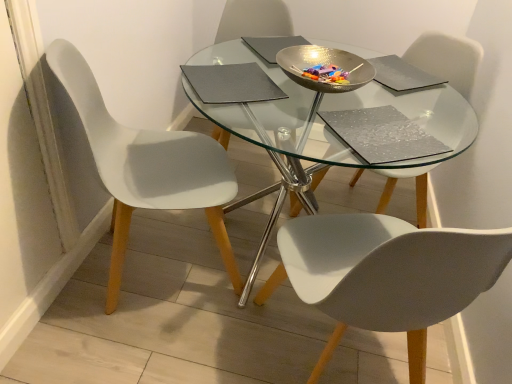
Question: From their relative heights in the image, would you say hammered metal bowl at center is taller or shorter than matte gray pad at upper center, which is the first pad from top to bottom?

Choices:
 (A) short
 (B) tall

Answer: (B)

Question: Considering the relative positions of hammered metal bowl at center and matte gray pad at upper center, which is the first pad from top to bottom, in the image provided, is hammered metal bowl at center to the left or to the right of matte gray pad at upper center, which is the first pad from top to bottom,?

Choices:
 (A) left
 (B) right

Answer: (B)

Question: Estimate the real-world distances between objects in this image. Which object is farther from the hammered metal bowl at center?

Choices:
 (A) white matte chair at left, which is the 1th chair in left-to-right order
 (B) matte gray pad at center, which is counted as the second pad, starting from the bottom
 (C) white matte chair at center, the second chair positioned from the left
 (D) matte gray pad at upper right, which is counted as the second pad, starting from the top
 (E) matte gray pad at upper center, positioned as the 4th pad in bottom-to-top order

Answer: (C)

Question: Considering the real-world distances, which object is farthest from the silver textured pad at center, the fourth pad positioned from the top?

Choices:
 (A) matte gray pad at upper center, positioned as the 4th pad in bottom-to-top order
 (B) hammered metal bowl at center
 (C) white matte chair at center, which appears as the third chair when viewed from the left
 (D) transparent glass table at center
 (E) white matte chair at center, which ranks as the second chair in right-to-left order

Answer: (C)